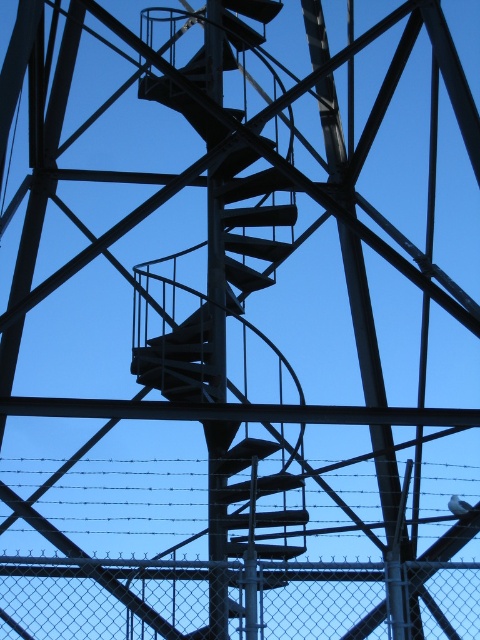
Question: Estimate the real-world distances between objects in this image. Which object is closer to the barbed wire at center?

Choices:
 (A) metallic spiral staircase at center
 (B) chain link fence at lower center

Answer: (A)

Question: Can you confirm if metallic spiral staircase at center is positioned below barbed wire at center?

Choices:
 (A) yes
 (B) no

Answer: (B)

Question: Does metallic spiral staircase at center have a larger size compared to barbed wire at center?

Choices:
 (A) no
 (B) yes

Answer: (B)

Question: Which point is farther to the camera?

Choices:
 (A) (299, 520)
 (B) (264, 58)
 (C) (312, 604)

Answer: (B)

Question: Estimate the real-world distances between objects in this image. Which object is farther from the chain link fence at lower center?

Choices:
 (A) chain link fence at center
 (B) barbed wire at center

Answer: (B)

Question: Is chain link fence at center smaller than barbed wire at center?

Choices:
 (A) yes
 (B) no

Answer: (A)